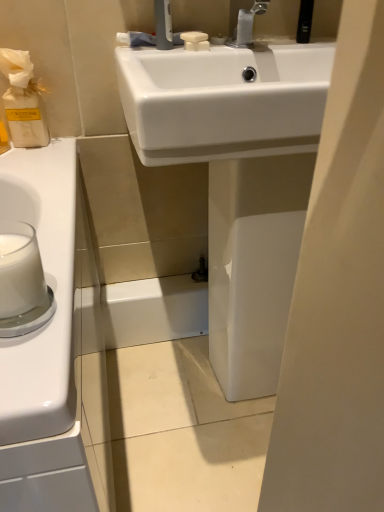
Describe the element at coordinates (20, 270) in the screenshot. Image resolution: width=384 pixels, height=512 pixels. I see `white opaque glass at left` at that location.

What is the approximate height of white matte soap at upper center?

The height of white matte soap at upper center is 0.69 inches.

The height and width of the screenshot is (512, 384). What do you see at coordinates (195, 40) in the screenshot? I see `white matte soap at upper center` at bounding box center [195, 40].

What do you see at coordinates (238, 179) in the screenshot? The image size is (384, 512). I see `white glossy sink at center` at bounding box center [238, 179].

Identify the location of silver metallic faucet at upper center. This screenshot has width=384, height=512. (246, 24).

Which object is thinner, silver metallic faucet at upper center or white matte soap at upper center?

white matte soap at upper center is thinner.

At what (x,y) coordinates should I click in order to perform the action: click on soap behind the silver metallic faucet at upper center. Please return your answer as a coordinate pair (x, y). Looking at the image, I should click on (195, 40).

Considering their positions, is silver metallic faucet at upper center located in front of or behind white matte soap at upper center?

In the image, silver metallic faucet at upper center appears in front of white matte soap at upper center.

From a real-world perspective, is silver metallic faucet at upper center physically below white matte soap at upper center?

No, from a real-world perspective, silver metallic faucet at upper center is not beneath white matte soap at upper center.

Is white opaque glass at left positioned with its back to white matte soap at upper center?

No, white matte soap at upper center is not at the back of white opaque glass at left.

Is white opaque glass at left behind white matte soap at upper center?

That is False.

Is white opaque glass at left spatially inside white matte soap at upper center, or outside of it?

The correct answer is: outside.

Is white opaque glass at left positioned behind white glossy sink at center?

No.

Considering the sizes of objects white opaque glass at left and white glossy sink at center in the image provided, who is bigger, white opaque glass at left or white glossy sink at center?

With larger size is white glossy sink at center.

Is the surface of white opaque glass at left in direct contact with white glossy sink at center?

No, white opaque glass at left is not making contact with white glossy sink at center.

Is white glossy sink at center located within white opaque glass at left?

No, white glossy sink at center is not inside white opaque glass at left.

Is white matte soap at upper center at the left side of white opaque glass at left?

Incorrect, white matte soap at upper center is not on the left side of white opaque glass at left.

Is white matte soap at upper center shorter than white opaque glass at left?

Yes.

Looking at this image, is white matte soap at upper center next to white opaque glass at left?

No.

In the scene shown: Who is bigger, white matte soap at upper center or white opaque glass at left?

white opaque glass at left.

From the image's perspective, is white matte soap at upper center above silver metallic faucet at upper center?

Actually, white matte soap at upper center appears below silver metallic faucet at upper center in the image.

Which is closer, (205, 49) or (242, 38)?

Point (205, 49).

Is white matte soap at upper center looking in the opposite direction of silver metallic faucet at upper center?

That's not correct — white matte soap at upper center is not looking away from silver metallic faucet at upper center.

Which object is further away from the camera taking this photo, white matte soap at upper center or silver metallic faucet at upper center?

white matte soap at upper center is more distant.

Can you confirm if white glossy sink at center is smaller than white matte soap at upper center?

Incorrect, white glossy sink at center is not smaller in size than white matte soap at upper center.

From the image's perspective, would you say white glossy sink at center is shown under white matte soap at upper center?

Yes, from the image's perspective, white glossy sink at center is beneath white matte soap at upper center.

Is white glossy sink at center oriented towards white matte soap at upper center?

No, white glossy sink at center is not turned towards white matte soap at upper center.

Find the location of `soap behind the white glossy sink at center`. soap behind the white glossy sink at center is located at coordinates (195, 40).

Who is shorter, white opaque glass at left or silver metallic faucet at upper center?

With less height is white opaque glass at left.

Who is more distant, white opaque glass at left or silver metallic faucet at upper center?

silver metallic faucet at upper center is behind.

What's the angular difference between white opaque glass at left and silver metallic faucet at upper center's facing directions?

The facing directions of white opaque glass at left and silver metallic faucet at upper center are 2.61 degrees apart.

Image resolution: width=384 pixels, height=512 pixels. I want to click on tap above the white opaque glass at left (from a real-world perspective), so click(x=246, y=24).

You are a GUI agent. You are given a task and a screenshot of the screen. Output one action in this format:
    pyautogui.click(x=<x>, y=<y>)
    Task: Click on the tap above the white matte soap at upper center (from the image's perspective)
    This screenshot has height=512, width=384.
    Given the screenshot: What is the action you would take?
    pyautogui.click(x=246, y=24)

At what (x,y) coordinates should I click in order to perform the action: click on soap above the white opaque glass at left (from a real-world perspective). Please return your answer as a coordinate pair (x, y). The height and width of the screenshot is (512, 384). Looking at the image, I should click on (195, 40).

Estimate the real-world distances between objects in this image. Which object is closer to white matte soap at upper center, white opaque glass at left or silver metallic faucet at upper center?

silver metallic faucet at upper center is positioned closer to the anchor white matte soap at upper center.

When comparing their distances from silver metallic faucet at upper center, does white glossy sink at center or white opaque glass at left seem closer?

Among the two, white glossy sink at center is located nearer to silver metallic faucet at upper center.

Which object lies further to the anchor point silver metallic faucet at upper center, white matte soap at upper center or white glossy sink at center?

white glossy sink at center.

Based on their spatial positions, is white opaque glass at left or white matte soap at upper center further from white glossy sink at center?

white opaque glass at left is further to white glossy sink at center.

Estimate the real-world distances between objects in this image. Which object is further from silver metallic faucet at upper center, white glossy sink at center or white matte soap at upper center?

Among the two, white glossy sink at center is located further to silver metallic faucet at upper center.

When comparing their distances from white matte soap at upper center, does silver metallic faucet at upper center or white glossy sink at center seem closer?

silver metallic faucet at upper center is closer to white matte soap at upper center.

When comparing their distances from white opaque glass at left, does silver metallic faucet at upper center or white glossy sink at center seem further?

Based on the image, silver metallic faucet at upper center appears to be further to white opaque glass at left.

Based on their spatial positions, is white opaque glass at left or silver metallic faucet at upper center further from white glossy sink at center?

white opaque glass at left is positioned further to the anchor white glossy sink at center.

Locate an element on the screen. sink between white matte soap at upper center and white opaque glass at left in the up-down direction is located at coordinates (238, 179).

At what (x,y) coordinates should I click in order to perform the action: click on soap between silver metallic faucet at upper center and white opaque glass at left in the vertical direction. Please return your answer as a coordinate pair (x, y). Looking at the image, I should click on (195, 40).

The image size is (384, 512). What are the coordinates of `sink between silver metallic faucet at upper center and white opaque glass at left from top to bottom` in the screenshot? It's located at (238, 179).

Locate an element on the screen. The width and height of the screenshot is (384, 512). soap between silver metallic faucet at upper center and white glossy sink at center in the up-down direction is located at coordinates (195, 40).